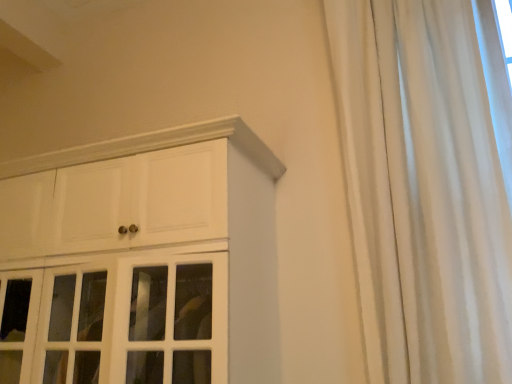
Question: From the image's perspective, relative to white silky curtain at right, is white glossy cabinet at upper left above or below?

Choices:
 (A) above
 (B) below

Answer: (B)

Question: Considering the relative positions of white glossy cabinet at upper left and white silky curtain at right in the image provided, is white glossy cabinet at upper left to the left or to the right of white silky curtain at right?

Choices:
 (A) right
 (B) left

Answer: (B)

Question: Is point (275, 324) closer or farther from the camera than point (382, 135)?

Choices:
 (A) closer
 (B) farther

Answer: (B)

Question: Considering the positions of white silky curtain at right and white glossy cabinet at upper left in the image, is white silky curtain at right wider or thinner than white glossy cabinet at upper left?

Choices:
 (A) thin
 (B) wide

Answer: (A)

Question: Considering the positions of white silky curtain at right and white glossy cabinet at upper left in the image, is white silky curtain at right taller or shorter than white glossy cabinet at upper left?

Choices:
 (A) tall
 (B) short

Answer: (A)

Question: Considering the positions of point (465, 89) and point (227, 220), is point (465, 89) closer or farther from the camera than point (227, 220)?

Choices:
 (A) farther
 (B) closer

Answer: (A)

Question: Based on their positions, is white silky curtain at right located to the left or right of white glossy cabinet at upper left?

Choices:
 (A) left
 (B) right

Answer: (B)